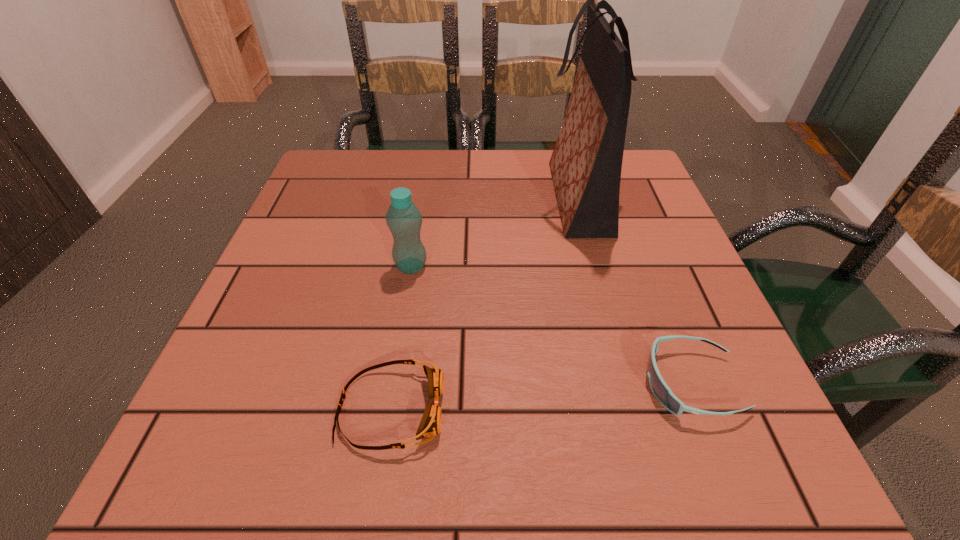
Identify the location of free space at the near edge. The width and height of the screenshot is (960, 540). (582, 458).

The height and width of the screenshot is (540, 960). What are the coordinates of `free space at the left edge` in the screenshot? It's located at (283, 307).

In the image, there is a desktop. At what (x,y) coordinates should I click in order to perform the action: click on vacant area at the right edge. Please return your answer as a coordinate pair (x, y). Looking at the image, I should click on (609, 246).

The width and height of the screenshot is (960, 540). Find the location of `free space at the far left corner`. free space at the far left corner is located at coordinates point(318,165).

Identify the location of free point at the near left corner. (260, 430).

In the image, there is a desktop. What are the coordinates of `blank space at the far right corner` in the screenshot? It's located at (635, 155).

In order to click on blank region between the left goggles and the right goggles in this screenshot , I will do `click(540, 396)`.

Identify the location of free space between the right goggles and the water bottle. Image resolution: width=960 pixels, height=540 pixels. coord(551,325).

This screenshot has height=540, width=960. Identify the location of unoccupied position between the left goggles and the water bottle. (401, 338).

This screenshot has width=960, height=540. Find the location of `vacant area that lies between the right goggles and the shopping bag`. vacant area that lies between the right goggles and the shopping bag is located at coordinates (634, 291).